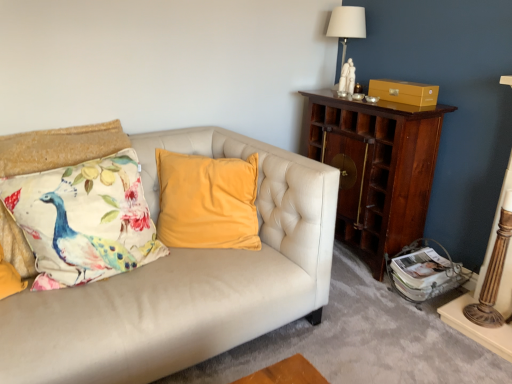
Question: Can you confirm if wooden cabinet at right is positioned to the right of white ceramic table lamp at upper right?

Choices:
 (A) yes
 (B) no

Answer: (A)

Question: Does wooden cabinet at right have a lesser height compared to white ceramic table lamp at upper right?

Choices:
 (A) yes
 (B) no

Answer: (B)

Question: Is wooden cabinet at right completely or partially outside of white ceramic table lamp at upper right?

Choices:
 (A) no
 (B) yes

Answer: (B)

Question: Is wooden cabinet at right next to white ceramic table lamp at upper right and touching it?

Choices:
 (A) yes
 (B) no

Answer: (B)

Question: Considering the relative positions of wooden cabinet at right and white ceramic table lamp at upper right in the image provided, is wooden cabinet at right behind white ceramic table lamp at upper right?

Choices:
 (A) no
 (B) yes

Answer: (A)

Question: Considering the relative sizes of wooden cabinet at right and white ceramic table lamp at upper right in the image provided, is wooden cabinet at right thinner than white ceramic table lamp at upper right?

Choices:
 (A) no
 (B) yes

Answer: (A)

Question: Considering the relative sizes of matte gold drawer at upper right and wooden cabinet at right in the image provided, is matte gold drawer at upper right taller than wooden cabinet at right?

Choices:
 (A) no
 (B) yes

Answer: (A)

Question: Is matte gold drawer at upper right outside wooden cabinet at right?

Choices:
 (A) no
 (B) yes

Answer: (B)

Question: Can you confirm if matte gold drawer at upper right is shorter than wooden cabinet at right?

Choices:
 (A) yes
 (B) no

Answer: (A)

Question: Is matte gold drawer at upper right in contact with wooden cabinet at right?

Choices:
 (A) yes
 (B) no

Answer: (B)

Question: Is matte gold drawer at upper right at the right side of wooden cabinet at right?

Choices:
 (A) no
 (B) yes

Answer: (B)

Question: Is matte gold drawer at upper right wider than wooden cabinet at right?

Choices:
 (A) no
 (B) yes

Answer: (A)

Question: Are printed fabric cushion with peacock design at left and white ceramic table lamp at upper right located far from each other?

Choices:
 (A) no
 (B) yes

Answer: (B)